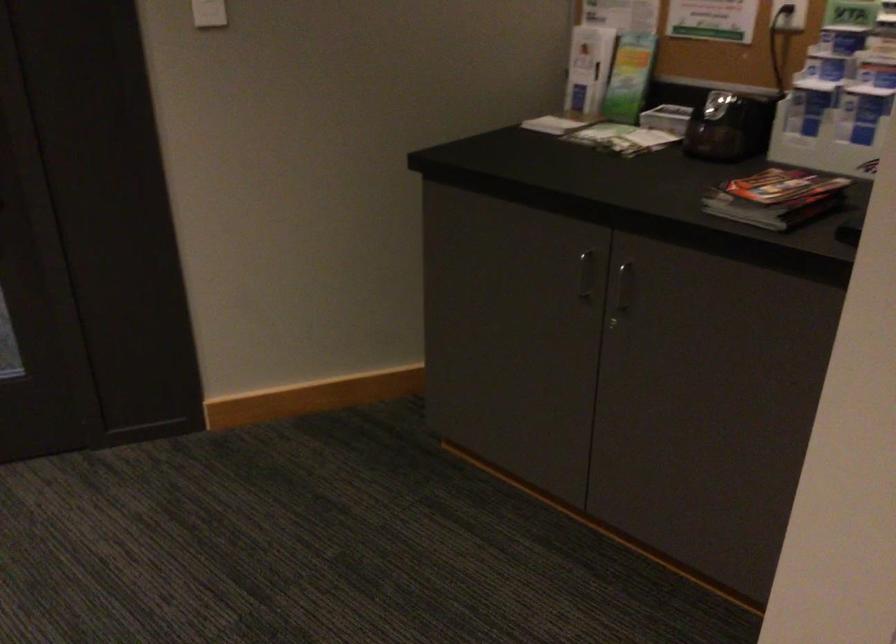
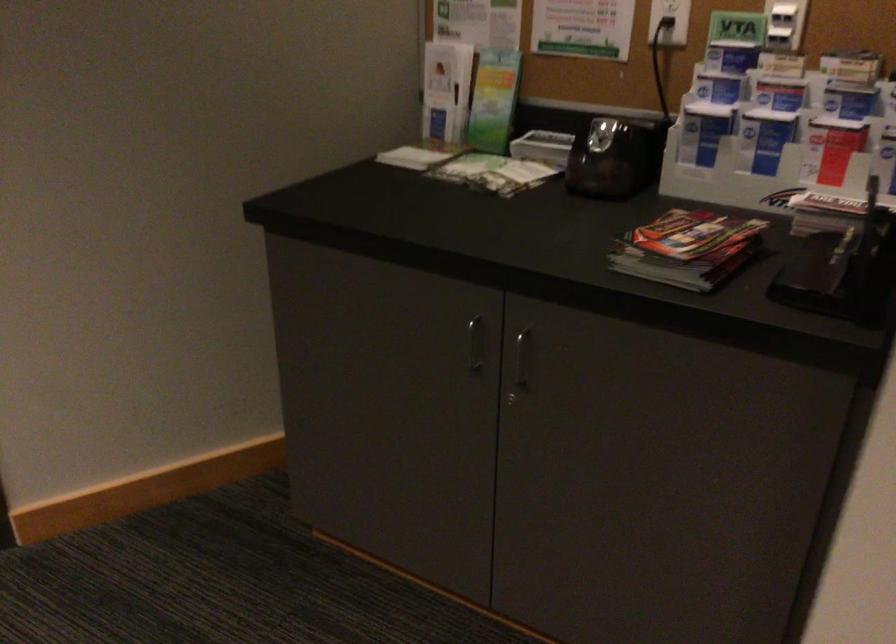
Locate, in the second image, the point that corresponds to the point at 722,126 in the first image.

(613, 158)